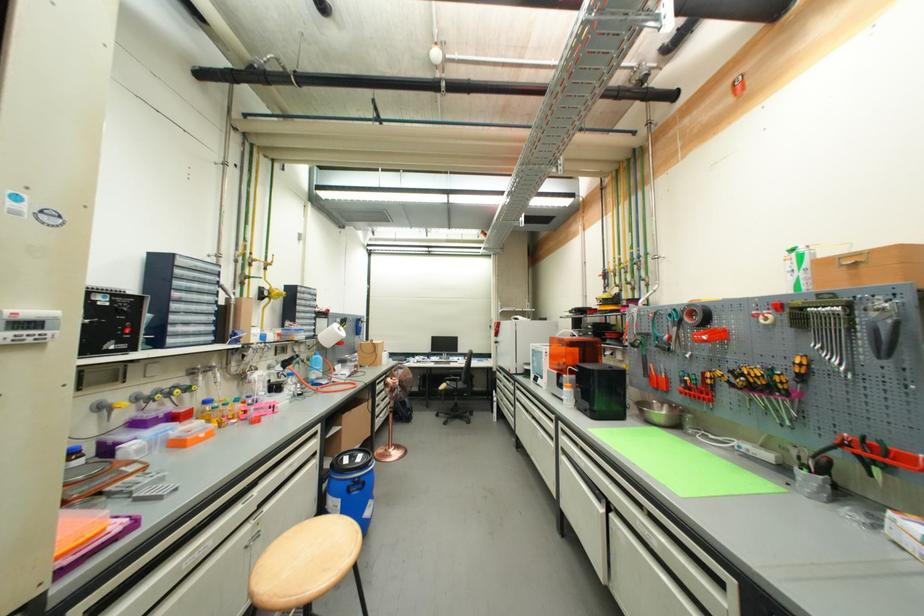
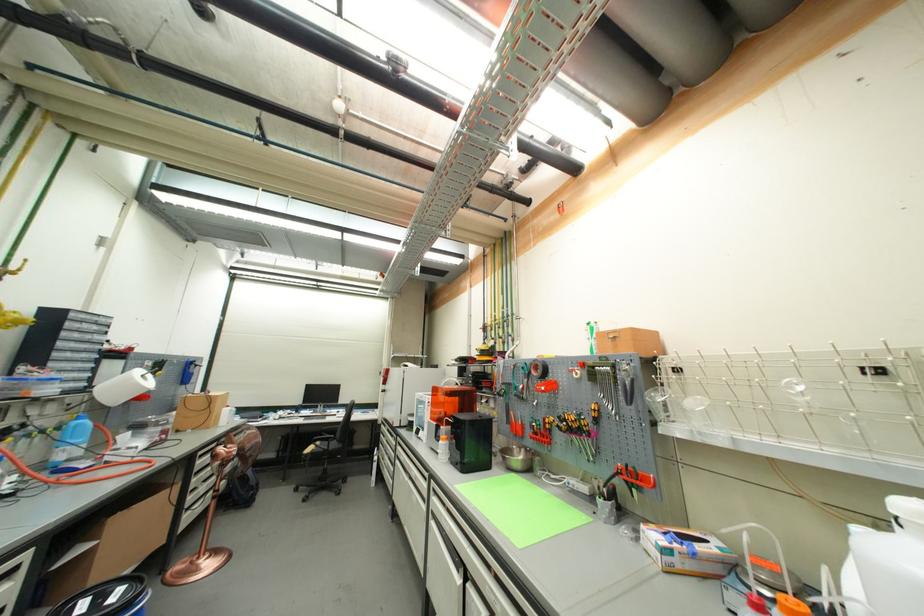
Where in the second image is the point corresponding to (x=359, y=460) from the first image?

(106, 601)